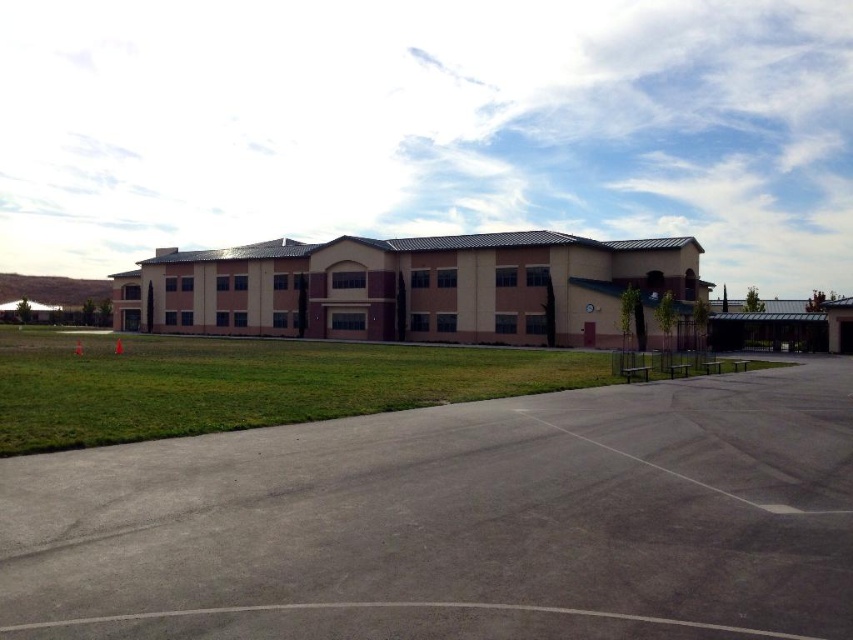
Question: Among these points, which one is nearest to the camera?

Choices:
 (A) (41, 440)
 (B) (279, 314)

Answer: (A)

Question: Among these points, which one is nearest to the camera?

Choices:
 (A) (169, 426)
 (B) (538, 268)

Answer: (A)

Question: Does beige stucco building at center lie in front of green grass at center?

Choices:
 (A) no
 (B) yes

Answer: (A)

Question: Does beige stucco building at center appear on the right side of green grass at center?

Choices:
 (A) yes
 (B) no

Answer: (B)

Question: Among these points, which one is nearest to the camera?

Choices:
 (A) (584, 378)
 (B) (556, 333)

Answer: (A)

Question: Where is beige stucco building at center located in relation to green grass at center in the image?

Choices:
 (A) below
 (B) above

Answer: (B)